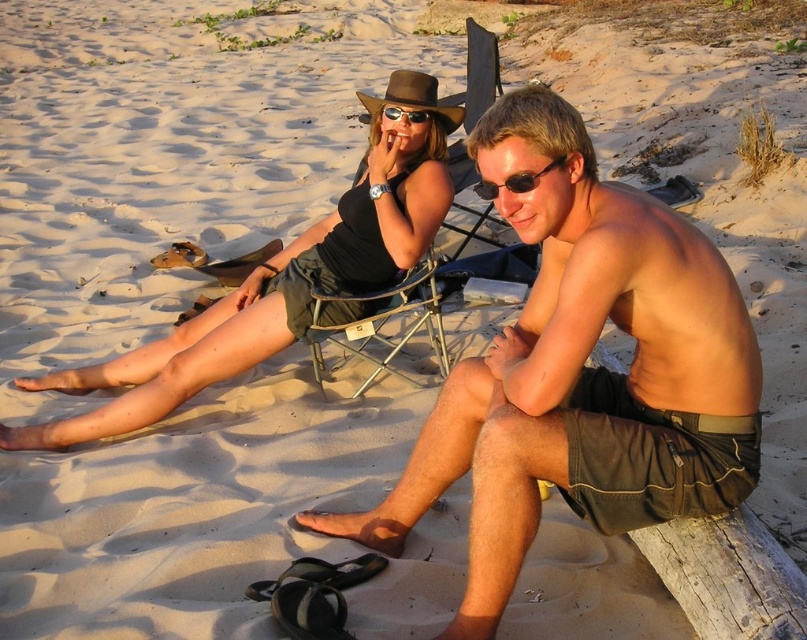
Is metallic folding chair at center wider than matte black sunglasses at center?

Correct, the width of metallic folding chair at center exceeds that of matte black sunglasses at center.

Between metallic folding chair at center and matte black sunglasses at center, which one is positioned higher?

metallic folding chair at center

Measure the distance between metallic folding chair at center and camera.

Answer: metallic folding chair at center and camera are 4.69 meters apart from each other.

Locate an element on the screen. This screenshot has width=807, height=640. metallic folding chair at center is located at coordinates (477, 74).

Is metallic folding chair at center positioned before brown felt cowboy hat at upper center?

No, it is not.

Describe the element at coordinates (477, 74) in the screenshot. I see `metallic folding chair at center` at that location.

Where is `metallic folding chair at center`? The image size is (807, 640). metallic folding chair at center is located at coordinates (477, 74).

Is brown felt cowboy hat at upper center below matte black sunglasses at center?

Incorrect, brown felt cowboy hat at upper center is not positioned below matte black sunglasses at center.

Can you confirm if brown felt cowboy hat at upper center is positioned to the right of matte black sunglasses at center?

Incorrect, brown felt cowboy hat at upper center is not on the right side of matte black sunglasses at center.

What do you see at coordinates (412, 97) in the screenshot? I see `brown felt cowboy hat at upper center` at bounding box center [412, 97].

Where is `brown felt cowboy hat at upper center`? brown felt cowboy hat at upper center is located at coordinates 412,97.